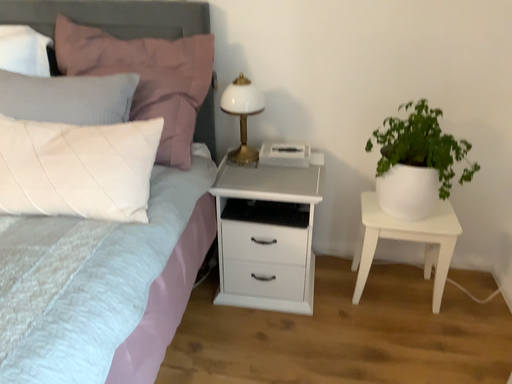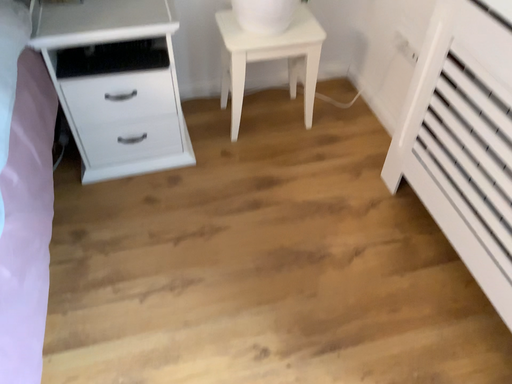
Question: Which way did the camera rotate in the video?

Choices:
 (A) rotated downward
 (B) rotated upward

Answer: (A)